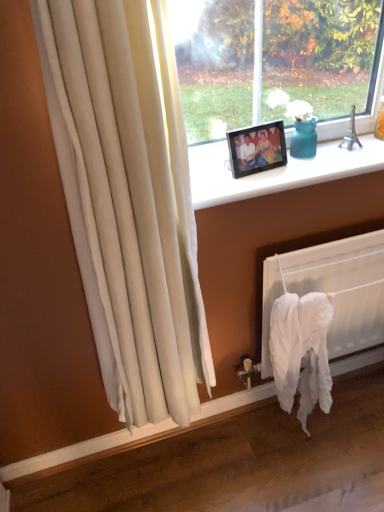
This screenshot has height=512, width=384. I want to click on empty space that is ontop of black plastic frame at upper center, so click(303, 161).